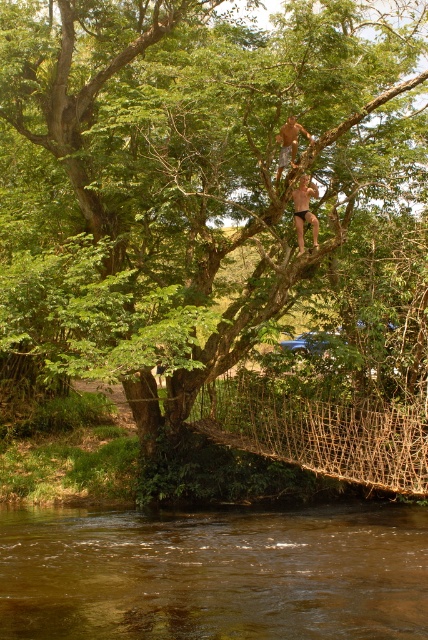
Question: Which of the following is the farthest from the observer?

Choices:
 (A) brown muddy water at lower center
 (B) brown woven rope bridge at lower center
 (C) green leafy tree at upper center
 (D) smooth skin child at upper center

Answer: (D)

Question: Does brown woven rope bridge at lower center appear over smooth skin child at upper center?

Choices:
 (A) no
 (B) yes

Answer: (A)

Question: Is the position of brown muddy water at lower center less distant than that of smooth skin child at upper center?

Choices:
 (A) yes
 (B) no

Answer: (A)

Question: Which object is closer to the camera taking this photo?

Choices:
 (A) brown woven rope bridge at lower center
 (B) brown leather belt at upper center

Answer: (B)

Question: Which point is farther to the camera?

Choices:
 (A) brown woven rope bridge at lower center
 (B) green leafy tree at upper center
 (C) brown muddy water at lower center
 (D) smooth skin child at upper center

Answer: (D)

Question: Can you confirm if green leafy tree at upper center is thinner than brown woven rope bridge at lower center?

Choices:
 (A) yes
 (B) no

Answer: (B)